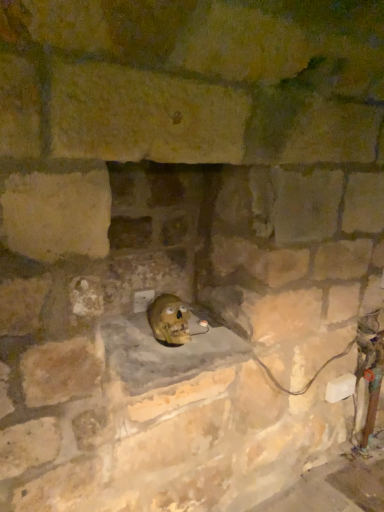
This screenshot has width=384, height=512. Describe the element at coordinates (169, 320) in the screenshot. I see `yellow matte skull at center` at that location.

This screenshot has width=384, height=512. I want to click on yellow matte skull at center, so click(x=169, y=320).

Identify the location of yellow matte skull at center. (169, 320).